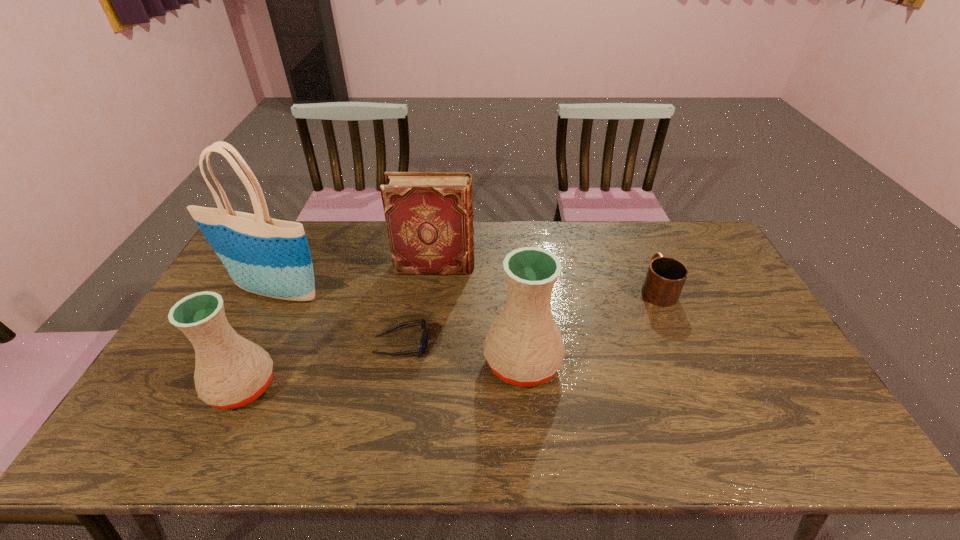
The image size is (960, 540). In order to click on free point located 0.050m on the back of the second object from right to left in this screenshot , I will do `click(518, 320)`.

Image resolution: width=960 pixels, height=540 pixels. I want to click on free region located on the spine side of the hardback book, so pyautogui.click(x=588, y=267).

Where is `vacant area located 0.230m on the side of the mug with the handle`? This screenshot has width=960, height=540. vacant area located 0.230m on the side of the mug with the handle is located at coordinates (632, 231).

What are the coordinates of `vacant space located 0.240m on the side of the mug with the handle` in the screenshot? It's located at (631, 229).

The height and width of the screenshot is (540, 960). What are the coordinates of `blank area located 0.070m on the side of the mug with the handle` in the screenshot? It's located at (643, 258).

Image resolution: width=960 pixels, height=540 pixels. Find the location of `free space located 0.340m on the front of the tote bag`. free space located 0.340m on the front of the tote bag is located at coordinates (219, 406).

Where is `free region located on the front-facing side of the shortest object`? This screenshot has width=960, height=540. free region located on the front-facing side of the shortest object is located at coordinates (558, 345).

You are a GUI agent. You are given a task and a screenshot of the screen. Output one action in this format:
    pyautogui.click(x=<x>, y=<y>)
    Task: Click on the object that is at the far edge
    
    Given the screenshot: What is the action you would take?
    pyautogui.click(x=429, y=216)

This screenshot has width=960, height=540. Identify the location of pottery that is at the left edge. (230, 372).

At what (x,y) coordinates should I click in order to perform the action: click on tote bag situated at the left edge. Please return your answer as a coordinate pair (x, y). Image resolution: width=960 pixels, height=540 pixels. Looking at the image, I should click on (265, 256).